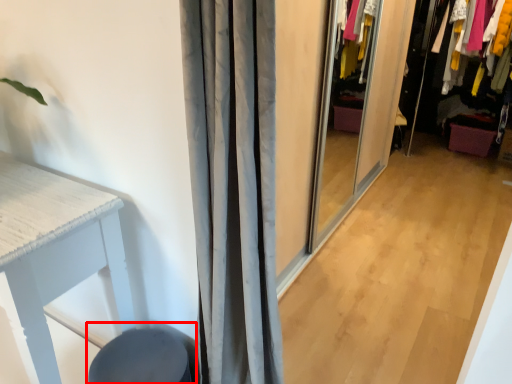
Question: Considering the relative positions of swivel chair (annotated by the red box) and closet in the image provided, where is swivel chair (annotated by the red box) located with respect to the staircase?

Choices:
 (A) left
 (B) right

Answer: (A)